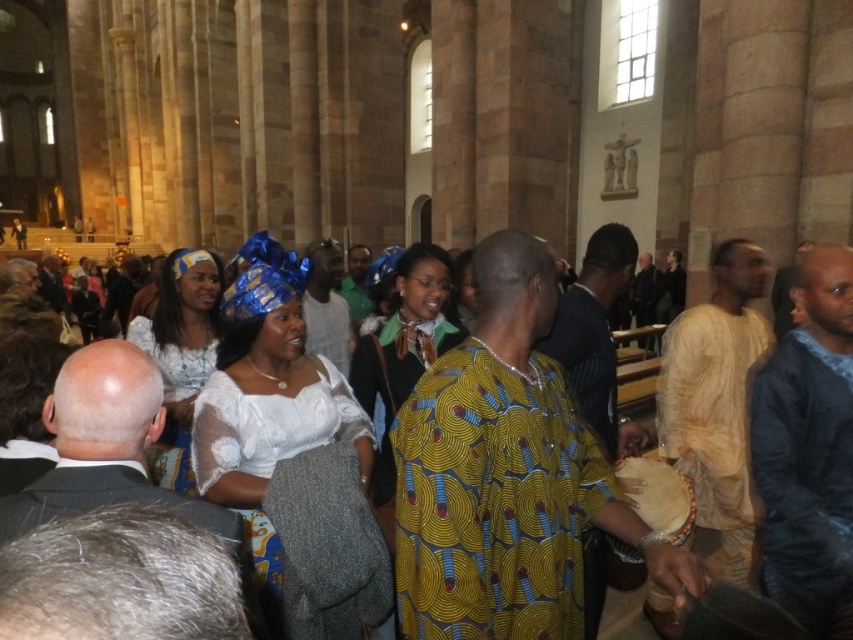
Question: Among these objects, which one is farthest from the camera?

Choices:
 (A) yellow printed fabric dress at center
 (B) white lace dress at center
 (C) matte blue fabric headwrap at center

Answer: (B)

Question: Is yellow printed dress at center positioned in front of white lace dress at center?

Choices:
 (A) no
 (B) yes

Answer: (B)

Question: Which object appears farthest from the camera in this image?

Choices:
 (A) yellow printed dress at center
 (B) matte blue fabric headwrap at center
 (C) white lace dress at center

Answer: (C)

Question: Does yellow printed fabric dress at center appear on the left side of matte blue fabric headwrap at center?

Choices:
 (A) yes
 (B) no

Answer: (B)

Question: Which of these objects is positioned farthest from the yellow printed fabric dress at center?

Choices:
 (A) white lace dress at center
 (B) matte blue fabric headwrap at center

Answer: (A)

Question: Is yellow printed fabric dress at center further to the viewer compared to yellow printed dress at center?

Choices:
 (A) yes
 (B) no

Answer: (B)